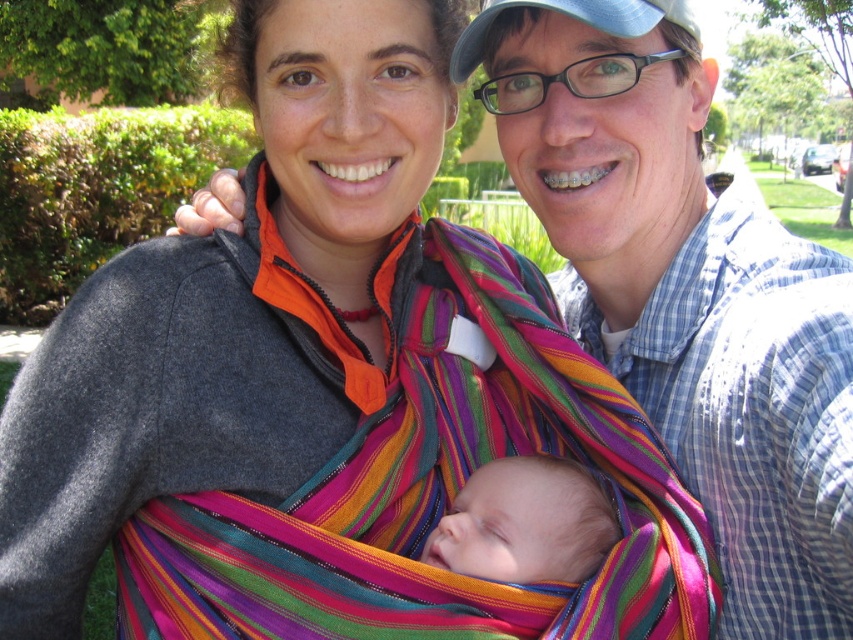
You are a photographer taking a family portrait. You need to ensure the soft pink fabric at center and the blue fabric baseball cap at upper center are both visible in the photo. Based on their positions, which one is closer to the bottom of the image?

The soft pink fabric at center is located below the blue fabric baseball cap at upper center, so the soft pink fabric at center is closer to the bottom of the image.

You are a photographer trying to capture a closeup of the baby between the two adults. The camera can only focus on objects within a specific range. If the camera is focused on point (563, 6), will the other point (503, 497) also be in focus?

Point (503, 497) is behind point (563, 6), so it will not be in focus if the camera is focused on the first point.